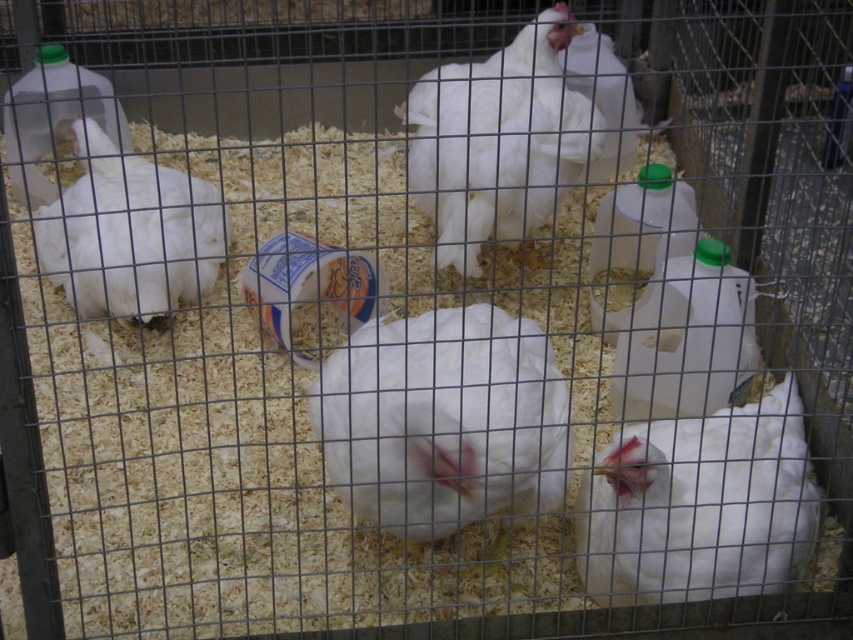
Question: Which object appears farthest from the camera in this image?

Choices:
 (A) green plastic bottle at center-right
 (B) white feathered chicken at left
 (C) white matte chicken at center

Answer: (A)

Question: Is green plastic bottle at right smaller than green plastic bottle at center-right?

Choices:
 (A) yes
 (B) no

Answer: (A)

Question: Can you confirm if white feathered chicken at center is wider than white feathered chicken at left?

Choices:
 (A) no
 (B) yes

Answer: (A)

Question: Among these points, which one is farthest from the camera?

Choices:
 (A) (109, 300)
 (B) (601, 209)
 (C) (637, 339)

Answer: (B)

Question: Estimate the real-world distances between objects in this image. Which object is farther from the white fluffy chicken at center?

Choices:
 (A) green plastic bottle at center-right
 (B) white feathered chicken at left
 (C) white matte chicken at center
 (D) green plastic bottle at right

Answer: (B)

Question: Does white fluffy chicken at center come behind green plastic bottle at center-right?

Choices:
 (A) no
 (B) yes

Answer: (A)